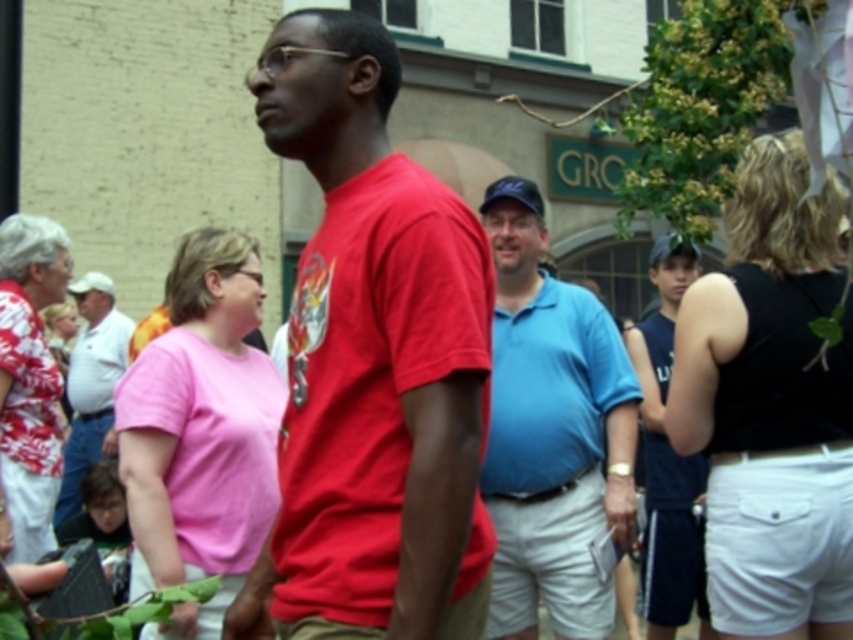
Who is positioned more to the right, hawaiian print blouse at left or dark blue jersey at right?

dark blue jersey at right

Does hawaiian print blouse at left have a greater width compared to dark blue jersey at right?

No, hawaiian print blouse at left is not wider than dark blue jersey at right.

Identify the location of hawaiian print blouse at left. (28, 378).

Where is `hawaiian print blouse at left`? Image resolution: width=853 pixels, height=640 pixels. hawaiian print blouse at left is located at coordinates (28, 378).

Does pink matte shirt at center lie in front of hawaiian print blouse at left?

That is True.

Between pink matte shirt at center and hawaiian print blouse at left, which one appears on the left side from the viewer's perspective?

hawaiian print blouse at left is more to the left.

Measure the distance between point [136,461] and camera.

Point [136,461] and camera are 24.83 meters apart.

This screenshot has width=853, height=640. What are the coordinates of `pink matte shirt at center` in the screenshot? It's located at (201, 429).

Which is behind, point (297, 269) or point (535, 604)?

The point (297, 269) is more distant.

Is the position of matte red t-shirt at center less distant than that of blue cotton shirt at center?

Yes, matte red t-shirt at center is in front of blue cotton shirt at center.

The height and width of the screenshot is (640, 853). What are the coordinates of `matte red t-shirt at center` in the screenshot? It's located at (370, 362).